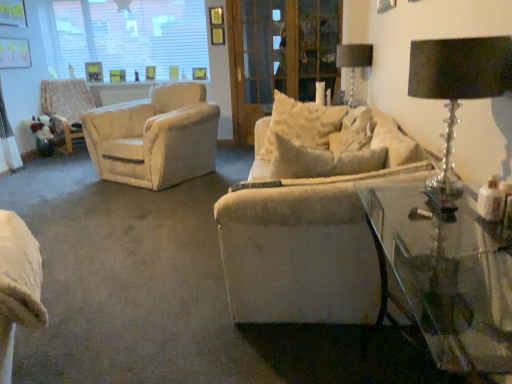
I want to click on empty space that is ontop of transparent glass table at lower right, so click(x=454, y=244).